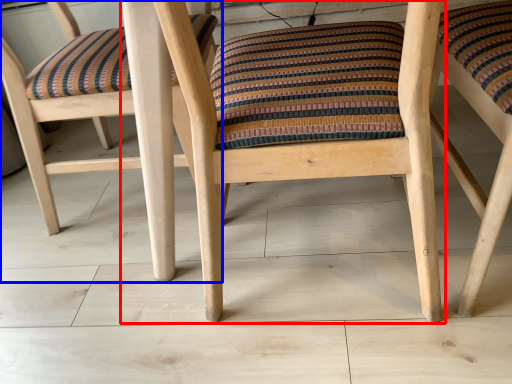
Question: Which object appears farthest to the camera in this image, chair (highlighted by a red box) or chair (highlighted by a blue box)?

Choices:
 (A) chair
 (B) chair

Answer: (B)